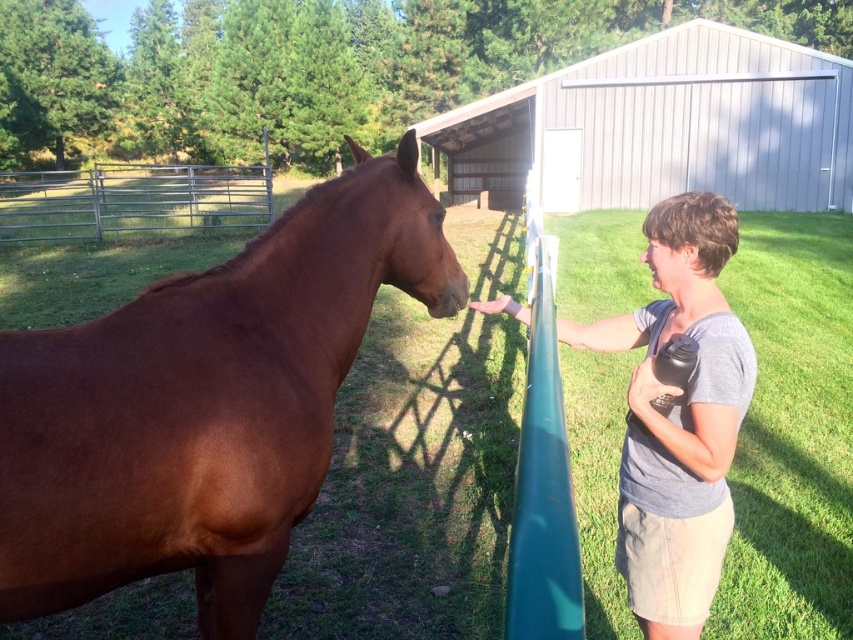
You are standing in the outdoor scene and want to place a small flower pot exactly at the point marked as point (683, 244). If the flower pot is 0.5 meters tall, will it be visible above the grass when placed there?

The distance of point (683, 244) from camera is 1.79 meters. Since the flower pot is 0.5 meters tall, it will be visible above the grass when placed there because its height exceeds the grass level at that point.

You are a photographer trying to capture a clear shot of the gray cotton shirt at center and the metallic silver fence at upper left. Which object will appear closer to the camera in the photo?

The gray cotton shirt at center will appear closer to the camera in the photo because it is positioned in front of the metallic silver fence at upper left.